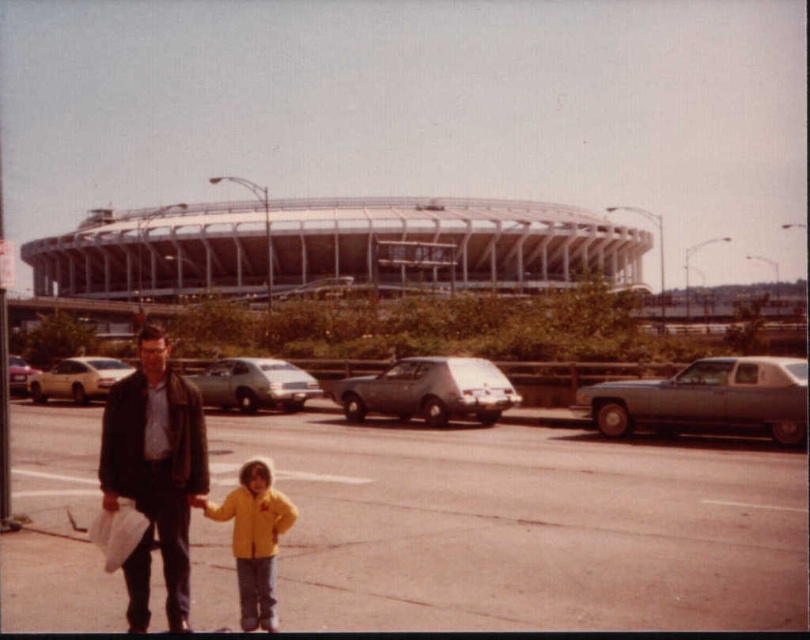
Measure the distance between point (245, 490) and camera.

Point (245, 490) and camera are 5.56 meters apart.

Measure the distance from yellow matte jacket at center to matte silver sedan at left.

17.55 meters

Between point (284, 524) and point (24, 371), which one is positioned in front?

Positioned in front is point (284, 524).

Find the location of a particular element. Image resolution: width=810 pixels, height=640 pixels. yellow matte jacket at center is located at coordinates (254, 540).

Is metallic silver sedan at right thinner than yellow matte jacket at center?

No.

Does metallic silver sedan at right have a larger size compared to yellow matte jacket at center?

Yes.

Where is `metallic silver sedan at right`? This screenshot has width=810, height=640. metallic silver sedan at right is located at coordinates (706, 400).

Does yellow matte jacket at center come in front of silver metallic sedan at center?

Yes, yellow matte jacket at center is in front of silver metallic sedan at center.

Between point (207, 512) and point (275, 406), which one is positioned behind?

The point (275, 406) is more distant.

Find the location of a particular element. The image size is (810, 640). yellow matte jacket at center is located at coordinates (254, 540).